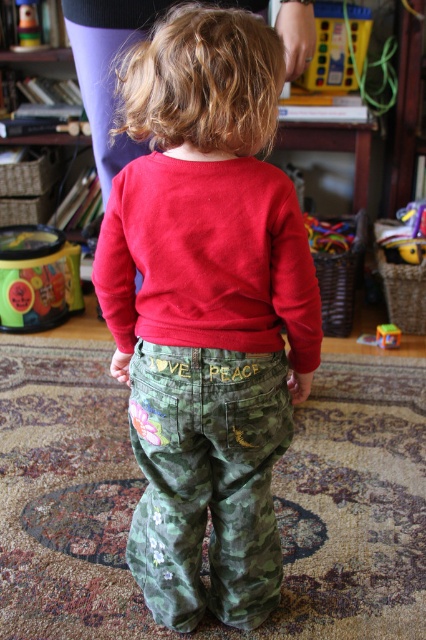
Does point (226, 525) come behind point (391, 342)?

No, (226, 525) is in front of (391, 342).

Who is shorter, camo fabric pants at center or matte plastic toy at center?

With less height is matte plastic toy at center.

Who is more forward, (180,392) or (383,332)?

Positioned in front is point (180,392).

Where is `camo fabric pants at center`? Image resolution: width=426 pixels, height=640 pixels. camo fabric pants at center is located at coordinates (207, 481).

Can you confirm if rubberized plastic toy at upper center is smaller than rubber duck at lower right?

No, rubberized plastic toy at upper center is not smaller than rubber duck at lower right.

I want to click on rubberized plastic toy at upper center, so click(x=330, y=52).

Where is `rubberized plastic toy at upper center`? The width and height of the screenshot is (426, 640). rubberized plastic toy at upper center is located at coordinates (330, 52).

Who is taller, rubber duck at lower right or rubberized plastic toy at upper left?

With more height is rubber duck at lower right.

Find the location of a particular element. This screenshot has height=640, width=426. rubber duck at lower right is located at coordinates (405, 236).

What are the coordinates of `rubber duck at lower right` in the screenshot? It's located at (405, 236).

The width and height of the screenshot is (426, 640). In order to click on rubber duck at lower right in this screenshot , I will do `click(405, 236)`.